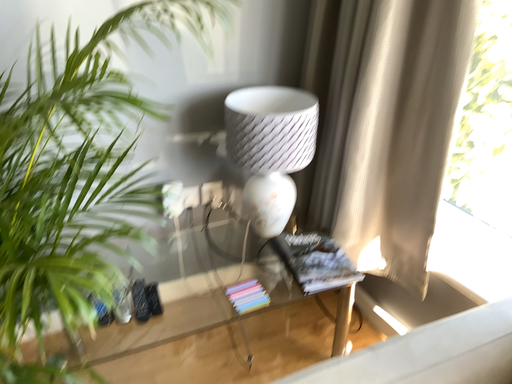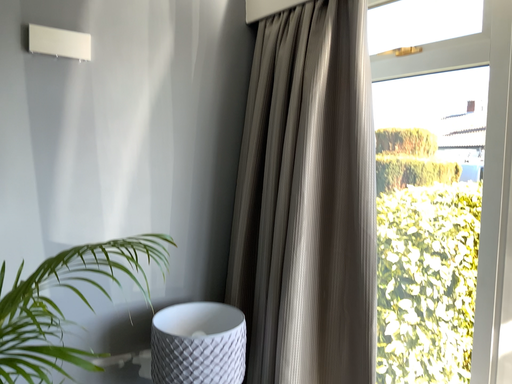
Question: Which way did the camera rotate in the video?

Choices:
 (A) rotated left
 (B) rotated right

Answer: (B)